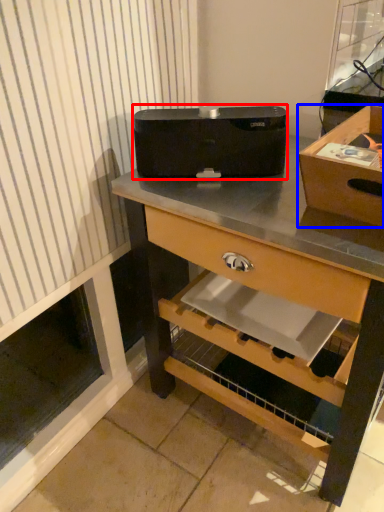
Question: Which of the following is the farthest to the observer, appliance (highlighted by a red box) or box (highlighted by a blue box)?

Choices:
 (A) appliance
 (B) box

Answer: (A)